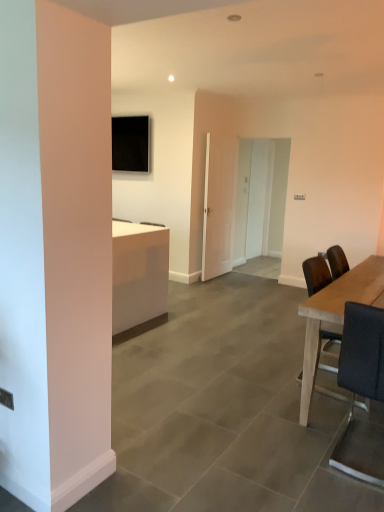
Question: From a real-world perspective, is white glossy door at center, which is the third glass door from back to front, physically below light brown wooden table at right?

Choices:
 (A) no
 (B) yes

Answer: (A)

Question: From the image's perspective, would you say white glossy door at center, which is the third glass door from back to front, is positioned over light brown wooden table at right?

Choices:
 (A) yes
 (B) no

Answer: (A)

Question: Is white glossy door at center, which is the third glass door from back to front, smaller than light brown wooden table at right?

Choices:
 (A) no
 (B) yes

Answer: (B)

Question: Is white glossy door at center, which is the third glass door from back to front, in front of light brown wooden table at right?

Choices:
 (A) no
 (B) yes

Answer: (A)

Question: From the image's perspective, is white glossy door at center, which is the first glass door from front to back, below light brown wooden table at right?

Choices:
 (A) yes
 (B) no

Answer: (B)

Question: Is light brown wooden table at right at the back of white glossy door at center, which is the first glass door from front to back?

Choices:
 (A) yes
 (B) no

Answer: (B)

Question: From the image's perspective, is light brown wooden table at right above black leather chair at right?

Choices:
 (A) yes
 (B) no

Answer: (A)

Question: Can you confirm if light brown wooden table at right is shorter than black leather chair at right?

Choices:
 (A) yes
 (B) no

Answer: (A)

Question: Considering the relative sizes of light brown wooden table at right and black leather chair at right in the image provided, is light brown wooden table at right thinner than black leather chair at right?

Choices:
 (A) no
 (B) yes

Answer: (A)

Question: Can you confirm if light brown wooden table at right is positioned to the left of black leather chair at right?

Choices:
 (A) yes
 (B) no

Answer: (B)

Question: Considering the relative sizes of light brown wooden table at right and black leather chair at right in the image provided, is light brown wooden table at right wider than black leather chair at right?

Choices:
 (A) yes
 (B) no

Answer: (A)

Question: Considering the relative positions of light brown wooden table at right and black leather chair at right in the image provided, is light brown wooden table at right to the right of black leather chair at right from the viewer's perspective?

Choices:
 (A) yes
 (B) no

Answer: (A)

Question: From a real-world perspective, is white glossy door at center, the 2th glass door from the back, physically above white glossy door at center, the third glass door when ordered from front to back?

Choices:
 (A) no
 (B) yes

Answer: (B)